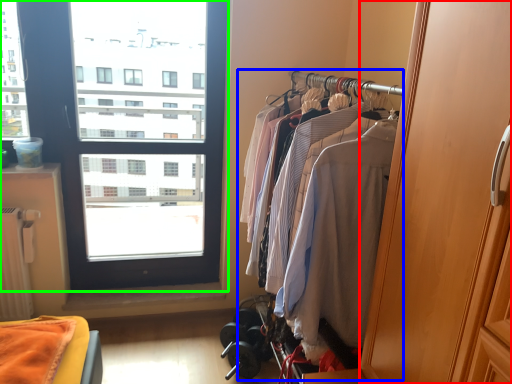
Question: Estimate the real-world distances between objects in this image. Which object is closer to screen door (highlighted by a red box), closet (highlighted by a blue box) or window (highlighted by a green box)?

Choices:
 (A) closet
 (B) window

Answer: (A)